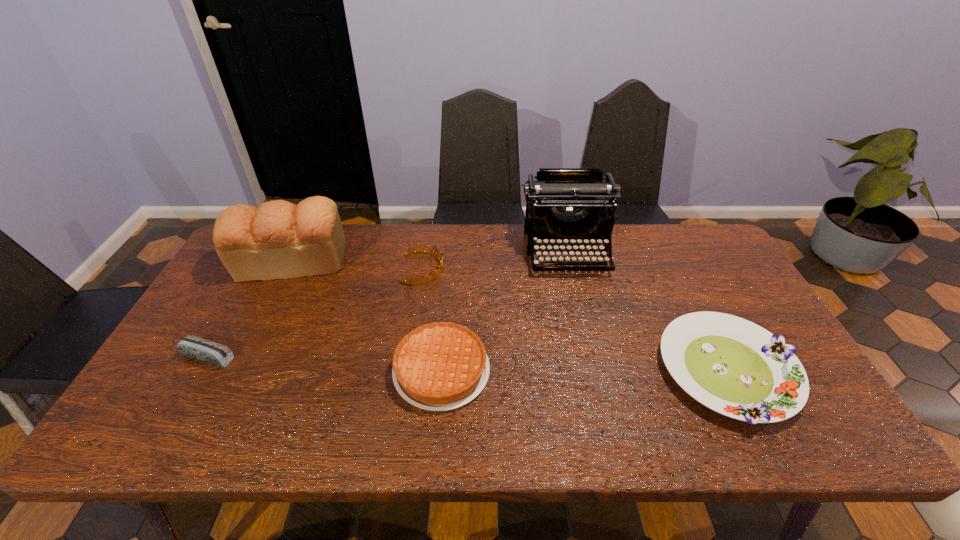
You are a GUI agent. You are given a task and a screenshot of the screen. Output one action in this format:
    pyautogui.click(x=<x>, y=<y>)
    Task: Click on the object that is at the far left corner
    This screenshot has width=960, height=540.
    Given the screenshot: What is the action you would take?
    pyautogui.click(x=279, y=240)

The width and height of the screenshot is (960, 540). I want to click on object that is at the near right corner, so coord(735,367).

Locate an element on the screen. The image size is (960, 540). free location at the far edge is located at coordinates (637, 232).

The height and width of the screenshot is (540, 960). What are the coordinates of `vacant space at the near edge of the desktop` in the screenshot? It's located at (233, 429).

Where is `free region at the left edge`? The height and width of the screenshot is (540, 960). free region at the left edge is located at coordinates (234, 297).

Locate an element on the screen. This screenshot has height=540, width=960. free space at the right edge of the desktop is located at coordinates (726, 289).

At what (x,y) coordinates should I click in order to perform the action: click on free space at the far right corner of the desktop. Please return your answer as a coordinate pair (x, y). Image resolution: width=960 pixels, height=540 pixels. Looking at the image, I should click on (699, 224).

The height and width of the screenshot is (540, 960). Find the location of `free space at the near right corner`. free space at the near right corner is located at coordinates (816, 441).

Locate an element on the screen. vacant point located between the tiara and the bread is located at coordinates (358, 265).

I want to click on free space that is in between the rightmost object and the pie, so (x=585, y=370).